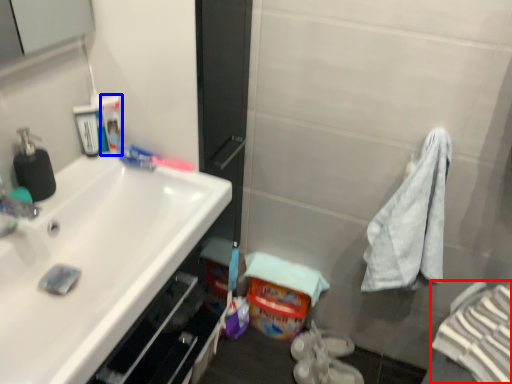
Question: Which point is closer to the camera, bath towel (highlighted by a red box) or mouthwash (highlighted by a blue box)?

Choices:
 (A) bath towel
 (B) mouthwash

Answer: (A)